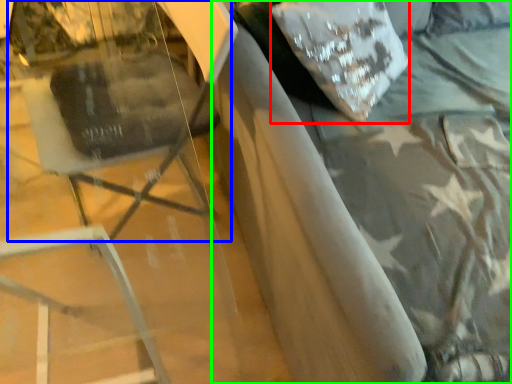
Question: Considering the real-world distances, which object is closest to pillow (highlighted by a red box)? swivel chair (highlighted by a blue box) or bed (highlighted by a green box).

Choices:
 (A) swivel chair
 (B) bed

Answer: (B)